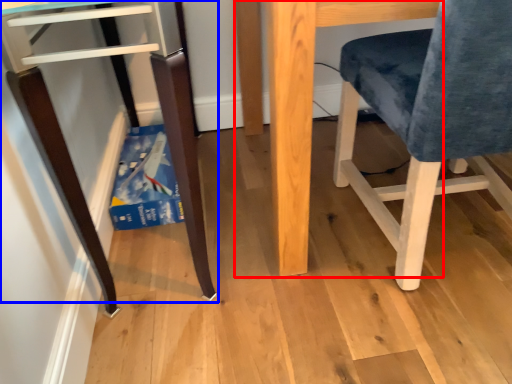
Question: Which of the following is the farthest to the observer, table (highlighted by a red box) or furniture (highlighted by a blue box)?

Choices:
 (A) table
 (B) furniture

Answer: (A)